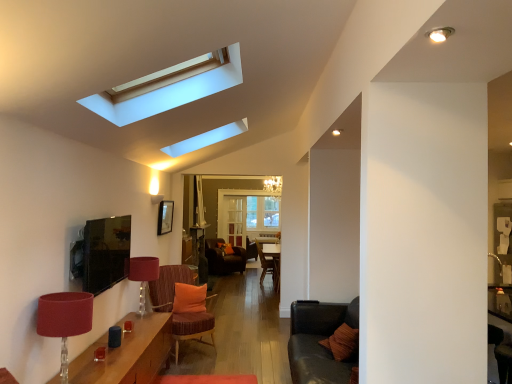
Where is `blank space above matte red lampshade at lower left, which appears as the 2th lamp when viewed from the back (from a real-world perspective)`? This screenshot has width=512, height=384. blank space above matte red lampshade at lower left, which appears as the 2th lamp when viewed from the back (from a real-world perspective) is located at coordinates click(65, 299).